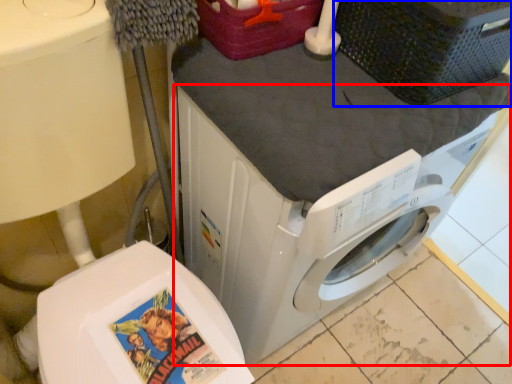
Question: Which object is closer to the camera taking this photo, washing machine (highlighted by a red box) or basket (highlighted by a blue box)?

Choices:
 (A) washing machine
 (B) basket

Answer: (A)